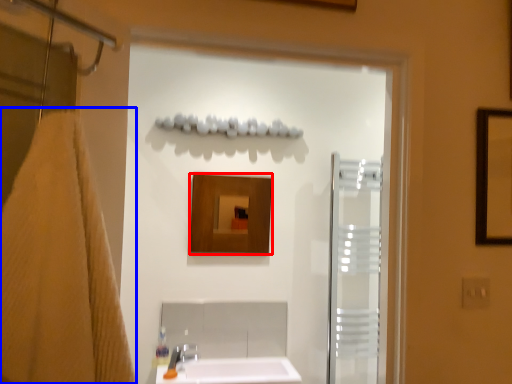
Question: Which point is closer to the camera, mirror (highlighted by a red box) or bath towel (highlighted by a blue box)?

Choices:
 (A) mirror
 (B) bath towel

Answer: (B)